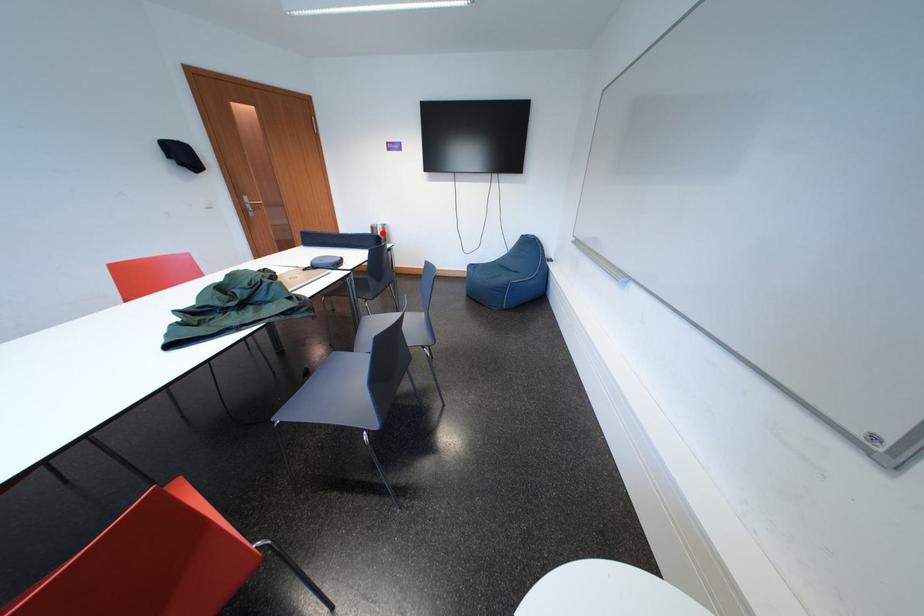
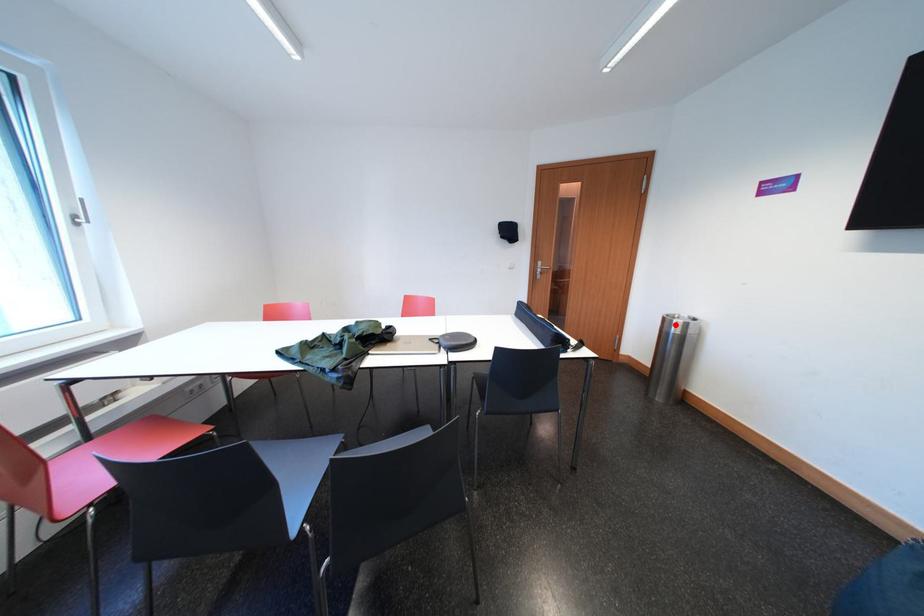
I am providing you with two images of the same scene from different viewpoints. A red point is marked on the first image and another point is marked on the second image. Is the red point in image1 aligned with the point shown in image2?

Yes